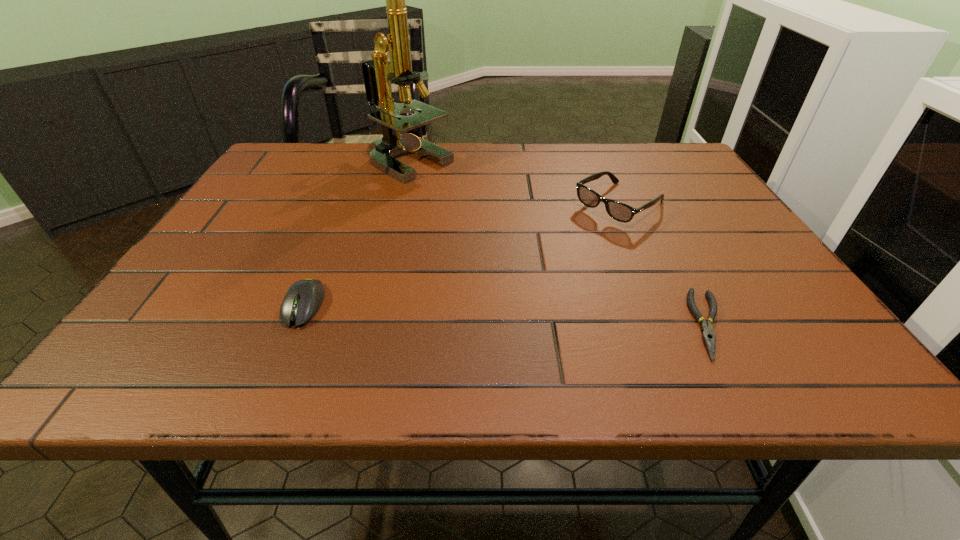
Where is `free space at the near edge`? The height and width of the screenshot is (540, 960). free space at the near edge is located at coordinates (258, 332).

Find the location of `vacant area at the left edge`. vacant area at the left edge is located at coordinates (222, 238).

This screenshot has height=540, width=960. I want to click on vacant area at the far right corner of the desktop, so click(655, 165).

I want to click on free space between the spectacles and the computer mouse, so click(x=462, y=255).

Locate an element on the screen. This screenshot has height=540, width=960. vacant space that's between the computer mouse and the tallest object is located at coordinates (356, 233).

What are the coordinates of `unoccupied position between the tallest object and the second tallest object` in the screenshot? It's located at (514, 184).

Locate an element on the screen. The height and width of the screenshot is (540, 960). free space that is in between the tallest object and the computer mouse is located at coordinates (356, 233).

Where is `free space between the microscope and the pliers`? free space between the microscope and the pliers is located at coordinates 559,243.

Identify the location of free space between the shortest object and the computer mouse. The height and width of the screenshot is (540, 960). (507, 315).

Find the location of `free spot between the third shortest object and the second shortest object`. free spot between the third shortest object and the second shortest object is located at coordinates (462, 255).